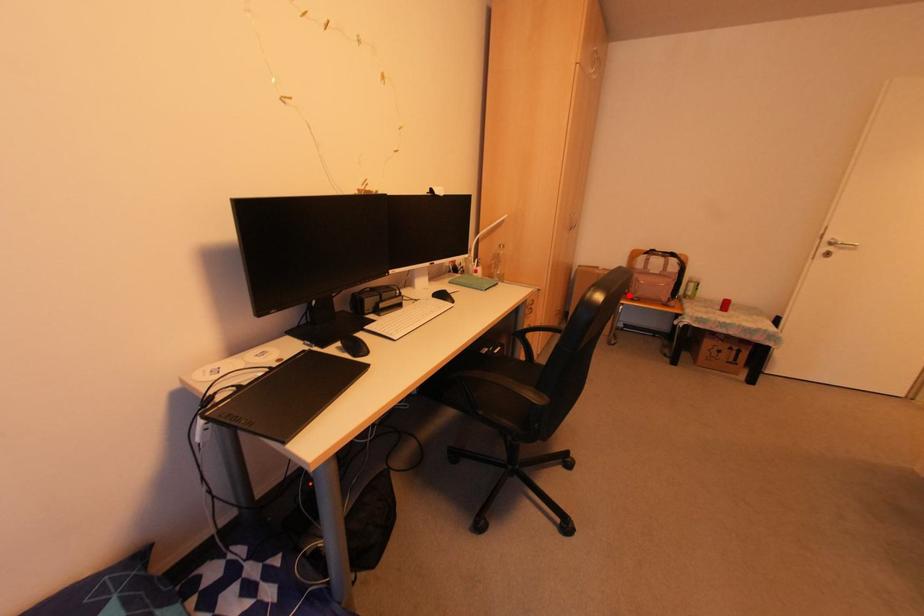
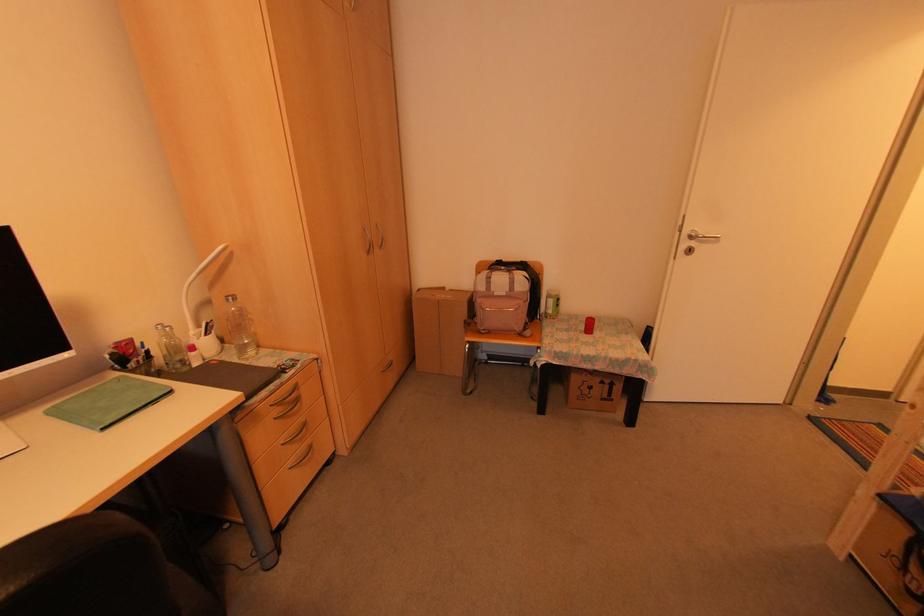
Question: I am providing you with two images of the same scene from different viewpoints. Given a red point in image1, look at the same physical point in image2. Is it:

Choices:
 (A) Closer to the viewpoint
 (B) Farther from the viewpoint

Answer: (A)